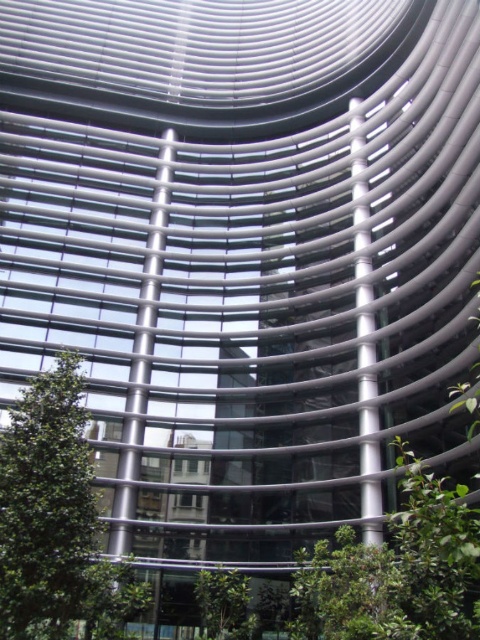
Is green leafy tree at lower left closer to camera compared to green leafy tree at lower center?

Yes, it is.

Does green leafy tree at lower left appear under green leafy tree at lower center?

No.

Measure the distance between point (0,576) and camera.

They are 9.01 meters apart.

Where is `green leafy tree at lower left`? The width and height of the screenshot is (480, 640). green leafy tree at lower left is located at coordinates (56, 522).